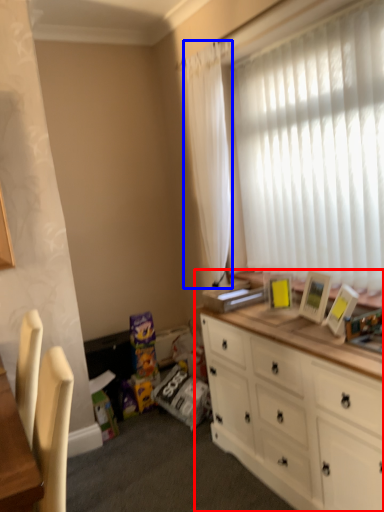
Question: Which object is further to the camera taking this photo, cabinetry (highlighted by a red box) or curtain (highlighted by a blue box)?

Choices:
 (A) cabinetry
 (B) curtain

Answer: (B)